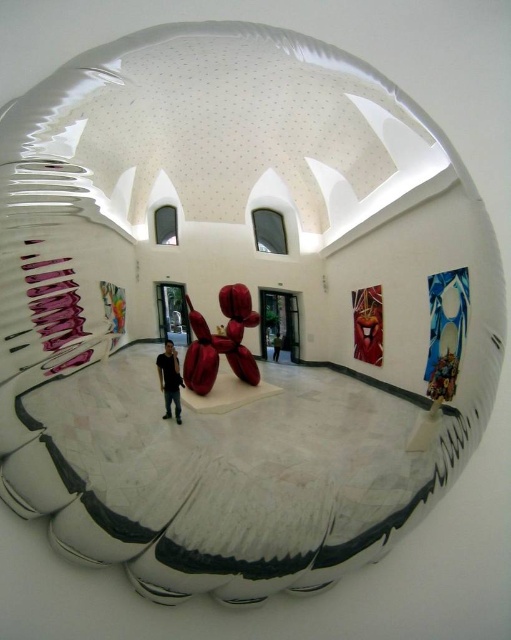
Question: Which point is farther to the camera?

Choices:
 (A) (185, 355)
 (B) (359, 300)

Answer: (B)

Question: Is shiny metallic balloon dog at center above dark brown leather jacket at center?

Choices:
 (A) yes
 (B) no

Answer: (A)

Question: Among these objects, which one is farthest from the camera?

Choices:
 (A) shiny metallic balloon dog at center
 (B) metallic red sculpture at right
 (C) dark brown leather jacket at center
 (D) dark gray shirt at center

Answer: (B)

Question: Considering the real-world distances, which object is farthest from the metallic red sculpture at right?

Choices:
 (A) dark brown leather jacket at center
 (B) dark gray shirt at center

Answer: (B)

Question: Is dark gray shirt at center positioned in front of dark brown leather jacket at center?

Choices:
 (A) no
 (B) yes

Answer: (A)

Question: Is dark gray shirt at center closer to the viewer compared to dark brown leather jacket at center?

Choices:
 (A) yes
 (B) no

Answer: (B)